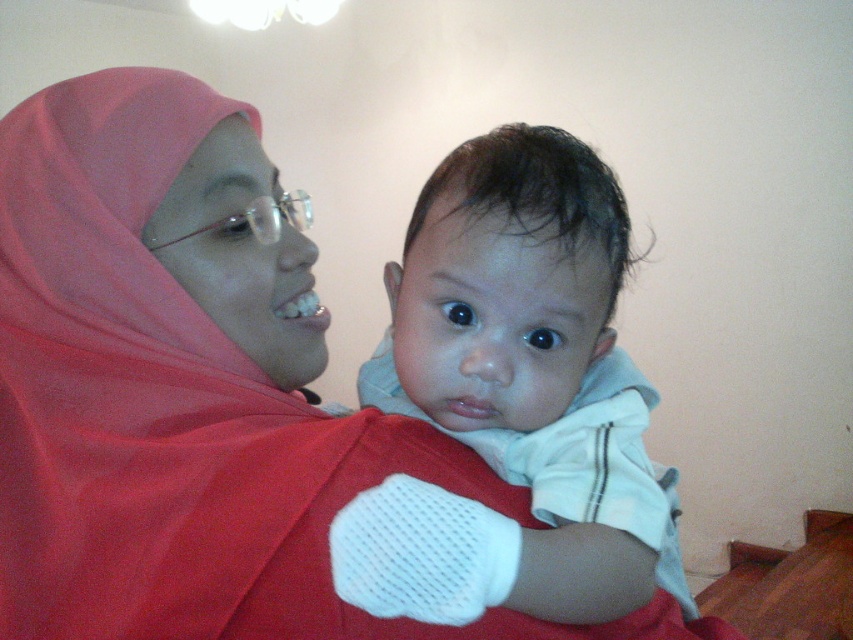
You are a photographer standing 24 inches away from the subject. You want to capture a closeup shot of the matte red hijab at center. Can you adjust your position to ensure the hijab is within the ideal 18 to 22 inches focus range for your camera lens?

The matte red hijab at center is currently 20.77 inches away from the viewer. Since this distance falls within the ideal 18 to 22 inches focus range, you don not need to adjust your position further. The current distance of 20.77 inches is already suitable for a sharp closeup shot.